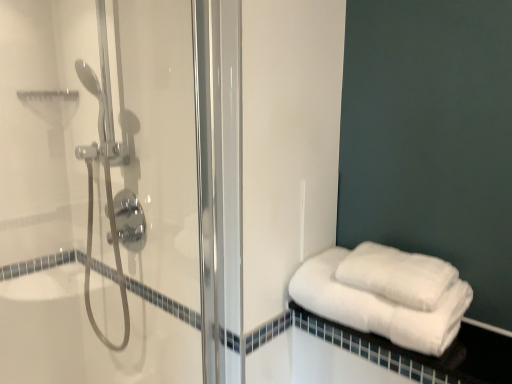
Image resolution: width=512 pixels, height=384 pixels. What do you see at coordinates (422, 354) in the screenshot? I see `white cotton towels at lower right` at bounding box center [422, 354].

Identify the location of clear glass shower door at left. (121, 191).

In order to face clear glass shower door at left, should I rotate leftwards or rightwards?

Turn left approximately 16.947 degrees to face it.

You are a GUI agent. You are given a task and a screenshot of the screen. Output one action in this format:
    pyautogui.click(x=<x>, y=<y>)
    Task: Click on the white cotton towels at lower right
    Image resolution: width=512 pixels, height=384 pixels.
    Given the screenshot: What is the action you would take?
    pyautogui.click(x=422, y=354)

Considering the relative sizes of clear glass shower door at left and white fluffy towels at right, the first towel in the bottom-to-top sequence, in the image provided, is clear glass shower door at left taller than white fluffy towels at right, the first towel in the bottom-to-top sequence,?

Correct, clear glass shower door at left is much taller as white fluffy towels at right, the first towel in the bottom-to-top sequence.

Looking at their sizes, would you say clear glass shower door at left is wider or thinner than white fluffy towels at right, the first towel in the bottom-to-top sequence?

Considering their sizes, clear glass shower door at left looks slimmer than white fluffy towels at right, the first towel in the bottom-to-top sequence.

Is clear glass shower door at left bigger or smaller than white fluffy towels at right, marked as the second towel in a top-to-bottom arrangement?

clear glass shower door at left is bigger than white fluffy towels at right, marked as the second towel in a top-to-bottom arrangement.

From the picture: Which is more to the right, white fluffy towels at right, the first towel in the bottom-to-top sequence, or white fluffy towels at lower right, which is the second towel from bottom to top?

From the viewer's perspective, white fluffy towels at lower right, which is the second towel from bottom to top, appears more on the right side.

Is white fluffy towels at right, marked as the second towel in a top-to-bottom arrangement, wider or thinner than white fluffy towels at lower right, which is the second towel from bottom to top?

Clearly, white fluffy towels at right, marked as the second towel in a top-to-bottom arrangement, has more width compared to white fluffy towels at lower right, which is the second towel from bottom to top.

Is white fluffy towels at lower right, the 1th towel from the top, at the back of white fluffy towels at right, the first towel in the bottom-to-top sequence?

No, white fluffy towels at lower right, the 1th towel from the top, is not at the back of white fluffy towels at right, the first towel in the bottom-to-top sequence.

Which point is more distant from viewer, (x=398, y=336) or (x=420, y=264)?

The point (x=420, y=264) is farther.

Is white fluffy towels at lower right, which is the second towel from bottom to top, at the left side of clear glass shower door at left?

Incorrect, white fluffy towels at lower right, which is the second towel from bottom to top, is not on the left side of clear glass shower door at left.

Looking at their sizes, would you say white fluffy towels at lower right, the 1th towel from the top, is wider or thinner than clear glass shower door at left?

white fluffy towels at lower right, the 1th towel from the top, is wider than clear glass shower door at left.

Looking at this image, is white fluffy towels at lower right, the 1th towel from the top, aimed at clear glass shower door at left?

No, white fluffy towels at lower right, the 1th towel from the top, is not oriented towards clear glass shower door at left.

From a real-world perspective, which is physically below, white fluffy towels at lower right, the 1th towel from the top, or clear glass shower door at left?

white fluffy towels at lower right, the 1th towel from the top, from a real-world perspective.

Locate an element on the screen. The image size is (512, 384). the 2nd towel to the left of the white cotton towels at lower right, starting your count from the anchor is located at coordinates (378, 307).

Are white cotton towels at lower right and white fluffy towels at right, the first towel in the bottom-to-top sequence, located far from each other?

No.

Is white cotton towels at lower right facing towards white fluffy towels at right, the first towel in the bottom-to-top sequence?

No, white cotton towels at lower right is not oriented towards white fluffy towels at right, the first towel in the bottom-to-top sequence.

Could white cotton towels at lower right be considered to be inside white fluffy towels at lower right, the 1th towel from the top?

No, white cotton towels at lower right is not a part of white fluffy towels at lower right, the 1th towel from the top.

Considering the sizes of objects white fluffy towels at lower right, which is the second towel from bottom to top, and white cotton towels at lower right in the image provided, who is thinner, white fluffy towels at lower right, which is the second towel from bottom to top, or white cotton towels at lower right?

Thinner between the two is white fluffy towels at lower right, which is the second towel from bottom to top.

Who is smaller, white fluffy towels at lower right, the 1th towel from the top, or white cotton towels at lower right?

Smaller between the two is white fluffy towels at lower right, the 1th towel from the top.

Is clear glass shower door at left surrounding white cotton towels at lower right?

No.

How much distance is there between clear glass shower door at left and white cotton towels at lower right?

clear glass shower door at left is 26.31 inches away from white cotton towels at lower right.

Visually, is clear glass shower door at left positioned to the left or to the right of white cotton towels at lower right?

clear glass shower door at left is positioned on white cotton towels at lower right's left side.

Is white fluffy towels at right, marked as the second towel in a top-to-bottom arrangement, facing towards white cotton towels at lower right?

No, white fluffy towels at right, marked as the second towel in a top-to-bottom arrangement, is not facing towards white cotton towels at lower right.

From a real-world perspective, does white fluffy towels at right, marked as the second towel in a top-to-bottom arrangement, stand above white cotton towels at lower right?

Indeed, from a real-world perspective, white fluffy towels at right, marked as the second towel in a top-to-bottom arrangement, stands above white cotton towels at lower right.

Is white fluffy towels at right, the first towel in the bottom-to-top sequence, positioned behind white cotton towels at lower right?

That is True.

Is white fluffy towels at right, marked as the second towel in a top-to-bottom arrangement, inside or outside of white cotton towels at lower right?

white fluffy towels at right, marked as the second towel in a top-to-bottom arrangement, is not enclosed by white cotton towels at lower right.

Image resolution: width=512 pixels, height=384 pixels. What are the coordinates of `shower door in front of the white fluffy towels at right, the first towel in the bottom-to-top sequence` in the screenshot? It's located at (121, 191).

Locate an element on the screen. The image size is (512, 384). towel below the white fluffy towels at lower right, the 1th towel from the top (from the image's perspective) is located at coordinates (378, 307).

Looking at the image, which one is located closer to white cotton towels at lower right, white fluffy towels at lower right, the 1th towel from the top, or white fluffy towels at right, marked as the second towel in a top-to-bottom arrangement?

white fluffy towels at right, marked as the second towel in a top-to-bottom arrangement, is positioned closer to the anchor white cotton towels at lower right.

Which object lies further to the anchor point white fluffy towels at right, the first towel in the bottom-to-top sequence, white fluffy towels at lower right, which is the second towel from bottom to top, or white cotton towels at lower right?

white cotton towels at lower right is positioned further to the anchor white fluffy towels at right, the first towel in the bottom-to-top sequence.

From the image, which object appears to be nearer to white cotton towels at lower right, white fluffy towels at right, marked as the second towel in a top-to-bottom arrangement, or white fluffy towels at lower right, which is the second towel from bottom to top?

white fluffy towels at right, marked as the second towel in a top-to-bottom arrangement, is positioned closer to the anchor white cotton towels at lower right.

Which object lies nearer to the anchor point white cotton towels at lower right, white fluffy towels at lower right, which is the second towel from bottom to top, or clear glass shower door at left?

Based on the image, white fluffy towels at lower right, which is the second towel from bottom to top, appears to be nearer to white cotton towels at lower right.

Based on the photo, looking at the image, which one is located closer to white cotton towels at lower right, clear glass shower door at left or white fluffy towels at right, marked as the second towel in a top-to-bottom arrangement?

white fluffy towels at right, marked as the second towel in a top-to-bottom arrangement, lies closer to white cotton towels at lower right than the other object.

From the image, which object appears to be farther from white cotton towels at lower right, white fluffy towels at right, marked as the second towel in a top-to-bottom arrangement, or clear glass shower door at left?

clear glass shower door at left is further to white cotton towels at lower right.

From the image, which object appears to be nearer to white fluffy towels at right, marked as the second towel in a top-to-bottom arrangement, white cotton towels at lower right or clear glass shower door at left?

white cotton towels at lower right.

Estimate the real-world distances between objects in this image. Which object is further from clear glass shower door at left, white cotton towels at lower right or white fluffy towels at lower right, the 1th towel from the top?

Among the two, white fluffy towels at lower right, the 1th towel from the top, is located further to clear glass shower door at left.

At what (x,y) coordinates should I click in order to perform the action: click on towel between white fluffy towels at lower right, which is the second towel from bottom to top, and white cotton towels at lower right from top to bottom. Please return your answer as a coordinate pair (x, y). The width and height of the screenshot is (512, 384). Looking at the image, I should click on (378, 307).

Find the location of `towel between clear glass shower door at left and white fluffy towels at lower right, the 1th towel from the top, from left to right`. towel between clear glass shower door at left and white fluffy towels at lower right, the 1th towel from the top, from left to right is located at coordinates (378, 307).